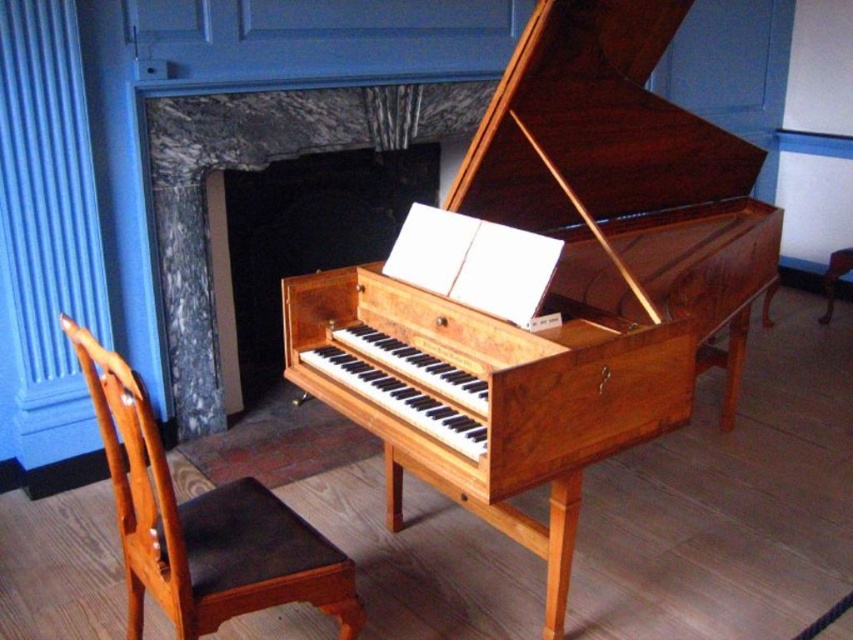
Question: Estimate the real-world distances between objects in this image. Which object is farther from the shiny brown wood harpsichord at center?

Choices:
 (A) brown wooden stool at lower right
 (B) mahogany wood chair at lower left

Answer: (A)

Question: Which point is closer to the camera?

Choices:
 (A) mahogany wood chair at lower left
 (B) shiny brown wood harpsichord at center
 (C) brown wooden stool at lower right

Answer: (A)

Question: Is shiny brown wood harpsichord at center bigger than mahogany wood chair at lower left?

Choices:
 (A) yes
 (B) no

Answer: (A)

Question: Which of the following is the closest to the observer?

Choices:
 (A) shiny brown wood harpsichord at center
 (B) mahogany wood chair at lower left

Answer: (B)

Question: Where is mahogany wood chair at lower left located in relation to brown wooden stool at lower right in the image?

Choices:
 (A) right
 (B) left

Answer: (B)

Question: Observing the image, what is the correct spatial positioning of mahogany wood chair at lower left in reference to brown wooden stool at lower right?

Choices:
 (A) above
 (B) below

Answer: (B)